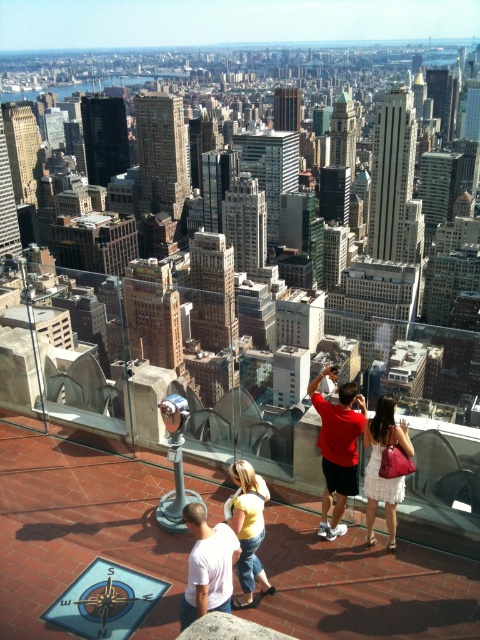
You are a photographer on the observation deck. You notice two people in the scene, one wearing a white lace dress at center and another in a yellow cotton shirt at center. Which clothing item is positioned higher relative to the other?

The white lace dress at center is located above the yellow cotton shirt at center, so the white lace dress at center is higher.